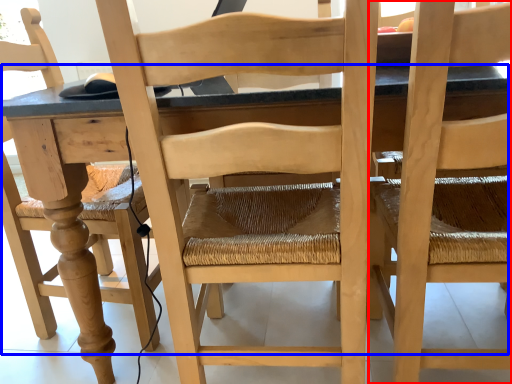
Question: Which object appears closest to the camera in this image, chair (highlighted by a red box) or table (highlighted by a blue box)?

Choices:
 (A) chair
 (B) table

Answer: (A)